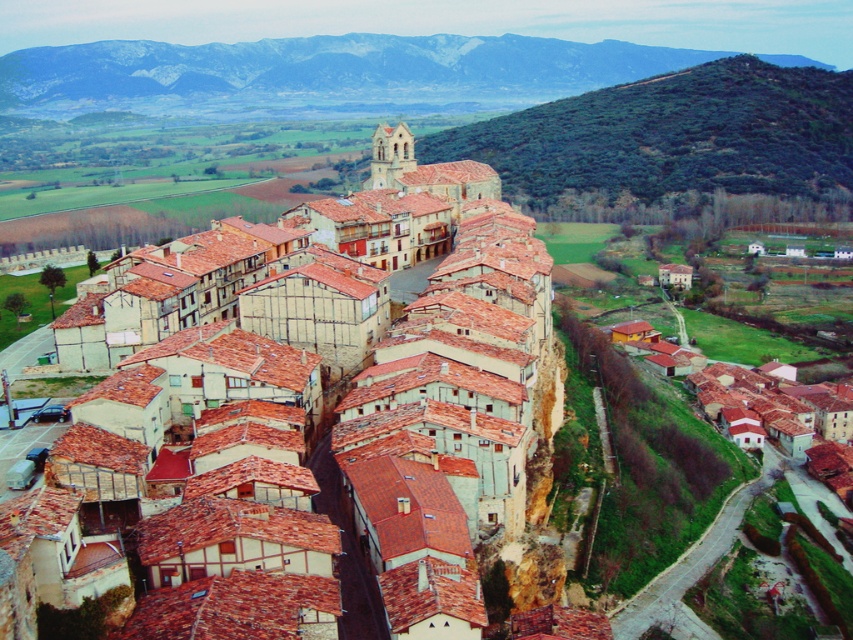
Is the position of matte clay roof tiles at center more distant than that of green leafy hillside at upper right?

No, it is not.

Does matte clay roof tiles at center have a larger size compared to green leafy hillside at upper right?

Actually, matte clay roof tiles at center might be smaller than green leafy hillside at upper right.

Consider the image. Who is more distant from viewer, (x=547, y=284) or (x=602, y=125)?

Positioned behind is point (x=602, y=125).

Locate an element on the screen. The image size is (853, 640). matte clay roof tiles at center is located at coordinates (357, 355).

Is matte clay roof tiles at center taller than rocky brown mountain at upper center?

No.

Image resolution: width=853 pixels, height=640 pixels. What are the coordinates of `matte clay roof tiles at center` in the screenshot? It's located at (357, 355).

The width and height of the screenshot is (853, 640). In order to click on matte clay roof tiles at center in this screenshot , I will do `click(357, 355)`.

In the scene shown: Between rocky brown mountain at upper center and green leafy hillside at upper right, which one appears on the right side from the viewer's perspective?

green leafy hillside at upper right

Between rocky brown mountain at upper center and green leafy hillside at upper right, which one has less height?

rocky brown mountain at upper center

In the scene shown: Measure the distance between rocky brown mountain at upper center and camera.

rocky brown mountain at upper center is 1813.06 feet from camera.

You are a GUI agent. You are given a task and a screenshot of the screen. Output one action in this format:
    pyautogui.click(x=<x>, y=<y>)
    Task: Click on the rocky brown mountain at upper center
    
    Given the screenshot: What is the action you would take?
    pyautogui.click(x=323, y=74)